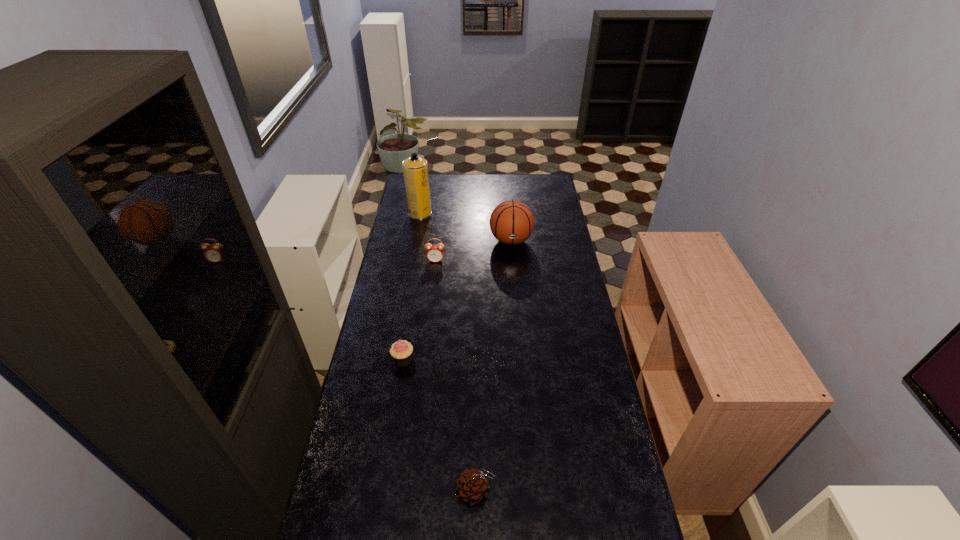
I want to click on the tallest object, so click(x=415, y=169).

Identify the location of aerosol can. (415, 169).

Where is `the fourth nearest object`? the fourth nearest object is located at coordinates (512, 222).

Find the location of a particular element. the second tallest object is located at coordinates (512, 222).

At what (x,y) coordinates should I click in order to perform the action: click on alarm clock. Please return your answer as a coordinate pair (x, y). Looking at the image, I should click on (434, 253).

You are a GUI agent. You are given a task and a screenshot of the screen. Output one action in this format:
    pyautogui.click(x=<x>, y=<y>)
    Task: Click on the fourth farthest object
    This screenshot has width=960, height=540.
    Given the screenshot: What is the action you would take?
    pyautogui.click(x=401, y=351)

Locate an element on the screen. This screenshot has width=960, height=540. pinecone is located at coordinates (472, 486).

Where is `blank area located 0.390m on the front of the farthest object`? blank area located 0.390m on the front of the farthest object is located at coordinates (410, 270).

Identify the location of vacant space located 0.050m on the side where the inflation valve is located. The image size is (960, 540). (513, 261).

Identify the location of vacant space situated on the clock face of the alarm clock. (429, 316).